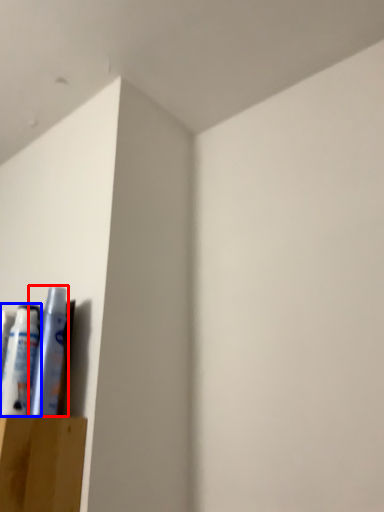
Question: Among these objects, which one is farthest to the camera, toiletry (highlighted by a red box) or toiletry (highlighted by a blue box)?

Choices:
 (A) toiletry
 (B) toiletry

Answer: (B)